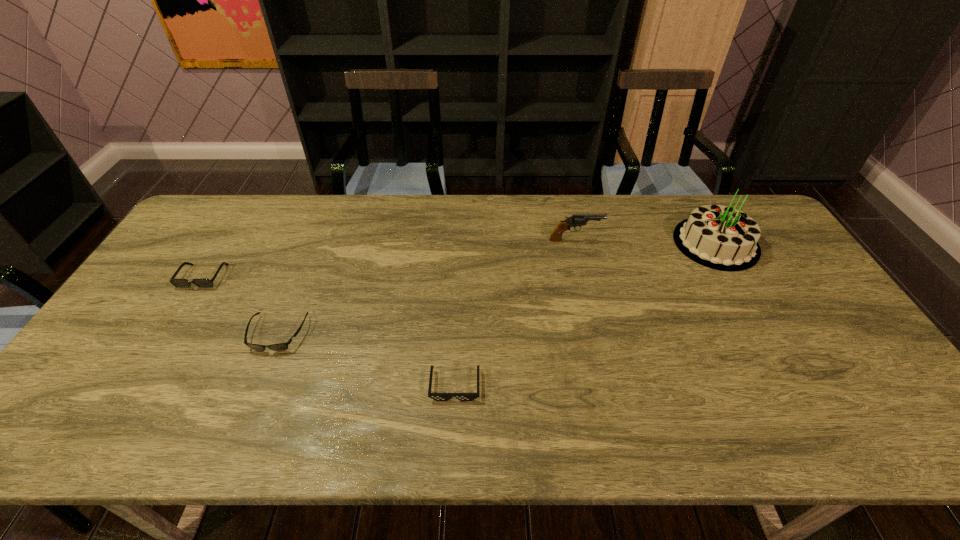
Image resolution: width=960 pixels, height=540 pixels. I want to click on vacant space that satisfies the following two spatial constraints: 1. along the barrel of the birthday cake; 2. on the left side of the fourth object from left to right, so click(576, 243).

Locate an element on the screen. This screenshot has width=960, height=540. blank space that satisfies the following two spatial constraints: 1. along the barrel of the second tallest object; 2. on the front-facing side of the nearest sunglasses is located at coordinates (610, 385).

You are a GUI agent. You are given a task and a screenshot of the screen. Output one action in this format:
    pyautogui.click(x=<x>, y=<y>)
    Task: Click on the vacant area that satisfies the following two spatial constraints: 1. on the back side of the rightmost object; 2. along the barrel of the gun
    The width and height of the screenshot is (960, 540).
    Given the screenshot: What is the action you would take?
    pyautogui.click(x=714, y=240)